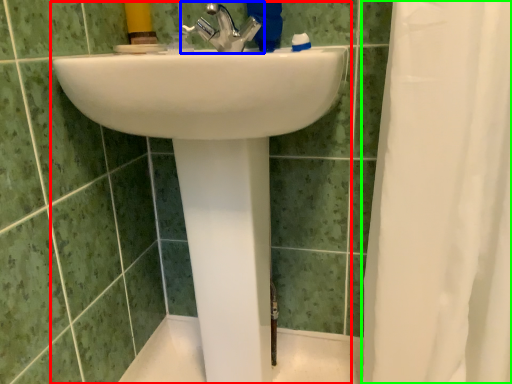
Question: Estimate the real-world distances between objects in this image. Which object is farther from sink (highlighted by a red box), tap (highlighted by a blue box) or shower curtain (highlighted by a green box)?

Choices:
 (A) tap
 (B) shower curtain

Answer: (A)